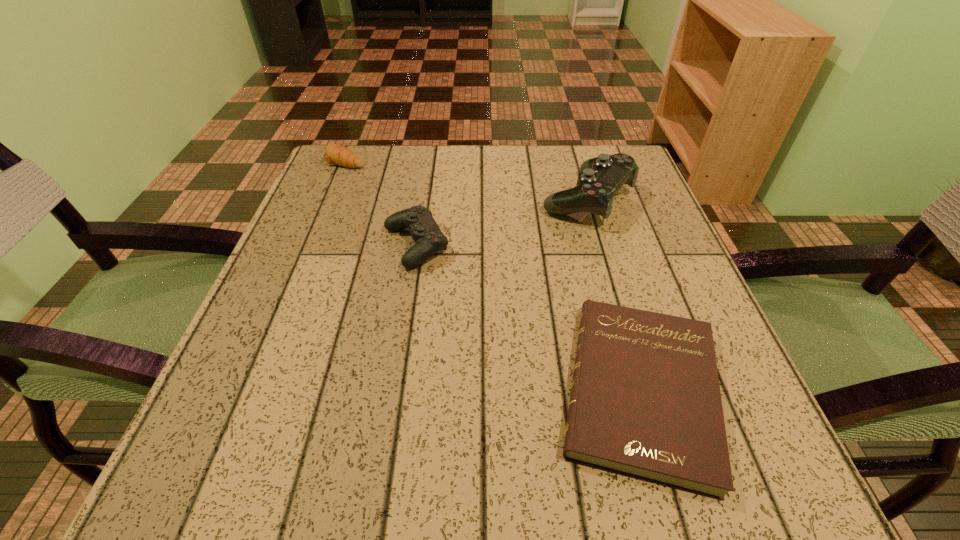
This screenshot has width=960, height=540. Find the location of `the tallest object`. the tallest object is located at coordinates (601, 177).

The height and width of the screenshot is (540, 960). I want to click on the taller control, so click(x=601, y=177).

Where is `the shorter control`? the shorter control is located at coordinates (429, 239).

Where is `the second tallest object`? the second tallest object is located at coordinates (429, 239).

Find the location of a particular element. This screenshot has height=540, width=960. the farthest object is located at coordinates (336, 154).

This screenshot has height=540, width=960. In order to click on crescent roll in this screenshot , I will do `click(336, 154)`.

The width and height of the screenshot is (960, 540). I want to click on hardback book, so click(645, 402).

At what (x,y) coordinates should I click in order to perform the action: click on the nearest object. Please return your answer as a coordinate pair (x, y). The image size is (960, 540). Looking at the image, I should click on (645, 402).

Find the location of a particular element. free region located on the back of the right control is located at coordinates (573, 150).

Locate an element on the screen. This screenshot has height=540, width=960. vacant space located 0.150m on the front of the left control is located at coordinates (400, 340).